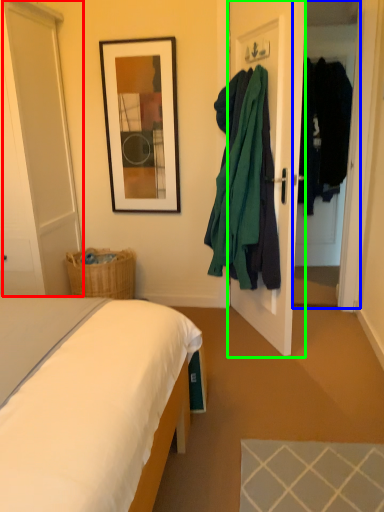
Question: Estimate the real-world distances between objects in this image. Which object is farther from glass door (highlighted by a red box), glass door (highlighted by a blue box) or door (highlighted by a green box)?

Choices:
 (A) glass door
 (B) door

Answer: (A)